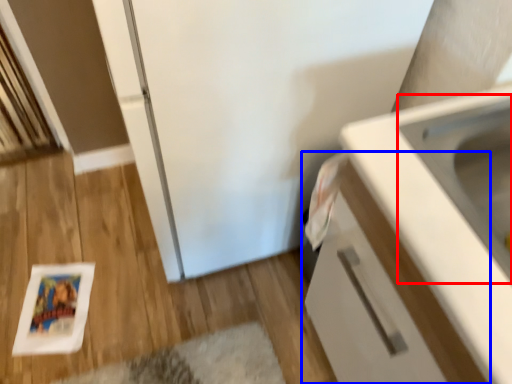
Question: Which of the following is the closest to the observer, sink (highlighted by a red box) or cabinetry (highlighted by a blue box)?

Choices:
 (A) sink
 (B) cabinetry

Answer: (B)